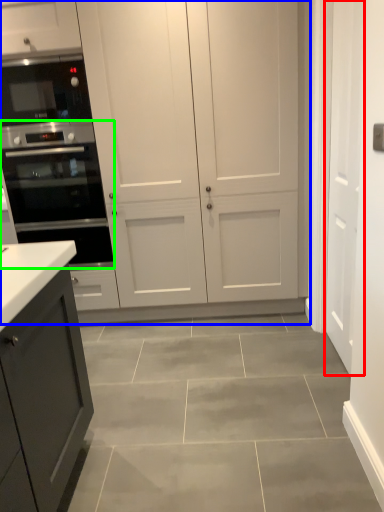
Question: Which is farther away from door (highlighted by a red box)? cupboard (highlighted by a blue box) or oven (highlighted by a green box)?

Choices:
 (A) cupboard
 (B) oven

Answer: (B)